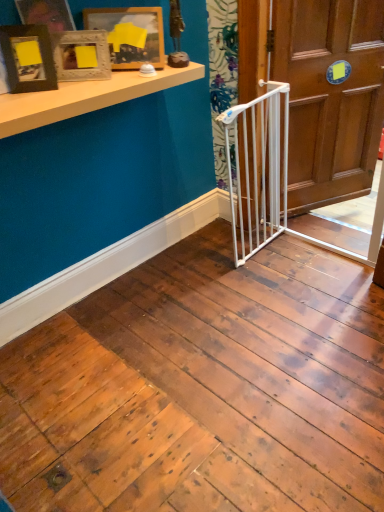
Question: Is matte black picture frame at upper left, the 3th picture frame in the back-to-front sequence, looking in the opposite direction of woodenobject at upper left, placed as the 2th picture frame when sorted from front to back?

Choices:
 (A) yes
 (B) no

Answer: (B)

Question: Is matte black picture frame at upper left, the first picture frame in the front-to-back sequence, facing towards woodenobject at upper left, which appears as the 2th picture frame when viewed from the back?

Choices:
 (A) yes
 (B) no

Answer: (B)

Question: Is matte black picture frame at upper left, the first picture frame in the front-to-back sequence, bigger than woodenobject at upper left, which appears as the 2th picture frame when viewed from the back?

Choices:
 (A) no
 (B) yes

Answer: (B)

Question: Can you confirm if matte black picture frame at upper left, the first picture frame in the front-to-back sequence, is positioned to the left of woodenobject at upper left, which appears as the 2th picture frame when viewed from the back?

Choices:
 (A) no
 (B) yes

Answer: (B)

Question: Considering the relative positions of matte black picture frame at upper left, the first picture frame in the front-to-back sequence, and woodenobject at upper left, which appears as the 2th picture frame when viewed from the back, in the image provided, is matte black picture frame at upper left, the first picture frame in the front-to-back sequence, in front of woodenobject at upper left, which appears as the 2th picture frame when viewed from the back,?

Choices:
 (A) no
 (B) yes

Answer: (B)

Question: Considering the relative sizes of matte black picture frame at upper left, the 3th picture frame in the back-to-front sequence, and woodenobject at upper left, which appears as the 2th picture frame when viewed from the back, in the image provided, is matte black picture frame at upper left, the 3th picture frame in the back-to-front sequence, taller than woodenobject at upper left, which appears as the 2th picture frame when viewed from the back,?

Choices:
 (A) no
 (B) yes

Answer: (B)

Question: Does woodenobject at upper left, which appears as the 2th picture frame when viewed from the back, appear on the left side of white wooden door at center?

Choices:
 (A) no
 (B) yes

Answer: (B)

Question: Is woodenobject at upper left, which appears as the 2th picture frame when viewed from the back, not close to white wooden door at center?

Choices:
 (A) yes
 (B) no

Answer: (A)

Question: Can you confirm if woodenobject at upper left, which appears as the 2th picture frame when viewed from the back, is thinner than white wooden door at center?

Choices:
 (A) no
 (B) yes

Answer: (B)

Question: Is woodenobject at upper left, which appears as the 2th picture frame when viewed from the back, beside white wooden door at center?

Choices:
 (A) no
 (B) yes

Answer: (A)

Question: Can you confirm if woodenobject at upper left, which appears as the 2th picture frame when viewed from the back, is taller than white wooden door at center?

Choices:
 (A) yes
 (B) no

Answer: (B)

Question: Is woodenobject at upper left, placed as the 2th picture frame when sorted from front to back, wider than white wooden door at center?

Choices:
 (A) yes
 (B) no

Answer: (B)

Question: Does white matte shelf at upper left have a larger size compared to white plastic gate at center?

Choices:
 (A) yes
 (B) no

Answer: (B)